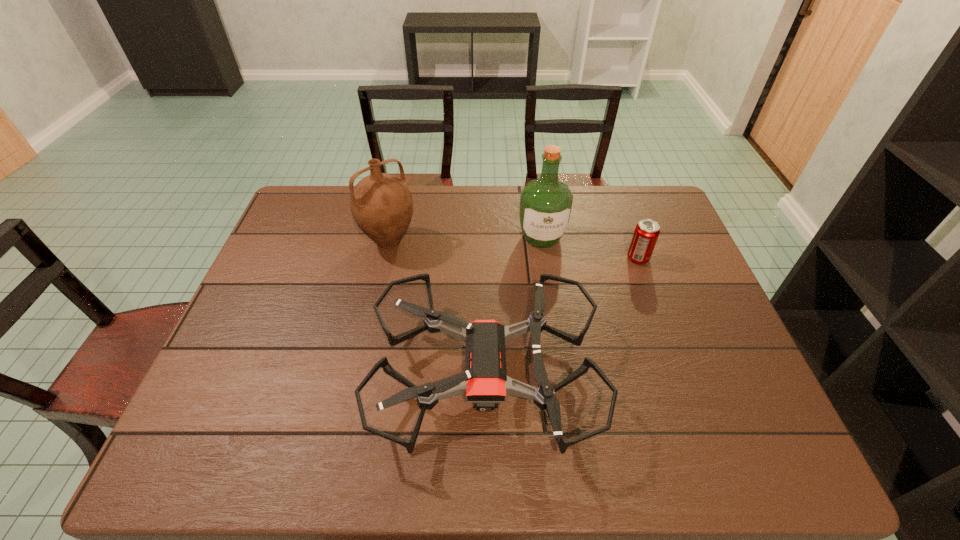
Identify the location of liquor that is at the far edge. The height and width of the screenshot is (540, 960). (546, 203).

Identify the location of pitcher situated at the far edge. This screenshot has width=960, height=540. (381, 204).

Find the location of `object that is at the near edge`. object that is at the near edge is located at coordinates (485, 382).

Find the location of `object that is at the right edge`. object that is at the right edge is located at coordinates (647, 231).

What are the coordinates of `vacant space at the far edge of the desktop` in the screenshot? It's located at (418, 195).

Locate an element on the screen. This screenshot has width=960, height=540. vacant space at the near edge is located at coordinates 635,463.

The height and width of the screenshot is (540, 960). Find the location of `vacant space at the left edge`. vacant space at the left edge is located at coordinates (263, 292).

At what (x,y) coordinates should I click in order to perform the action: click on vacant region at the right edge of the desktop. Please return your answer as a coordinate pair (x, y). This screenshot has height=540, width=960. Looking at the image, I should click on (675, 289).

You are a GUI agent. You are given a task and a screenshot of the screen. Output one action in this format:
    pyautogui.click(x=<x>, y=<y>)
    Task: Click on the vacant space at the far right corner of the desktop
    The image size is (960, 540).
    Given the screenshot: What is the action you would take?
    pyautogui.click(x=654, y=187)

Locate an element on the screen. The image size is (960, 540). free space that is in between the soda can and the pitcher is located at coordinates (514, 250).